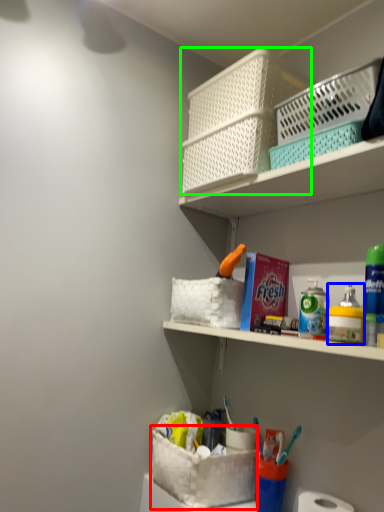
Question: Based on their relative distances, which object is farther from basket container (highlighted by a red box)? Choose from toiletry (highlighted by a blue box) and basket container (highlighted by a green box).

Choices:
 (A) toiletry
 (B) basket container

Answer: (B)